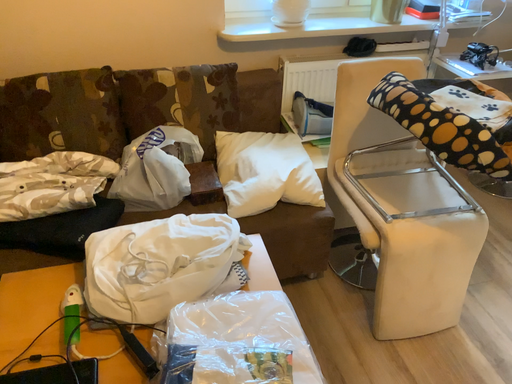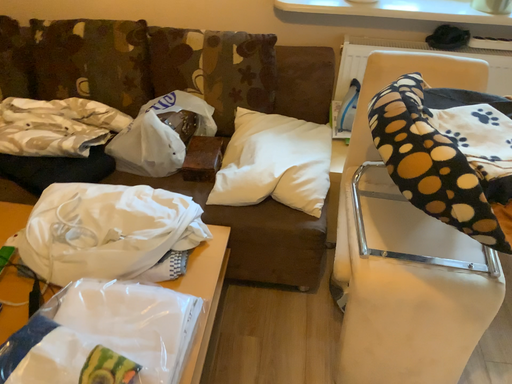
Question: How did the camera likely rotate when shooting the video?

Choices:
 (A) rotated right
 (B) rotated left

Answer: (B)